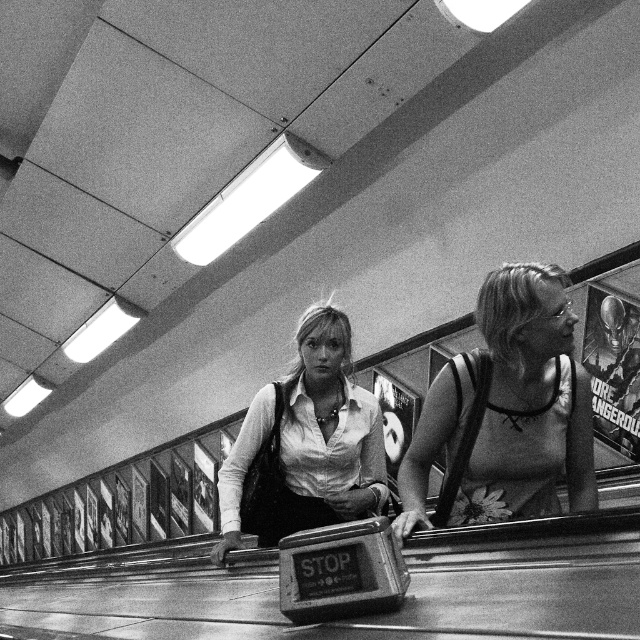
Question: Which point is closer to the camera taking this photo?

Choices:
 (A) pyautogui.click(x=472, y=509)
 (B) pyautogui.click(x=268, y=410)

Answer: (A)

Question: Does floral-patterned tank top at right come behind matte white shirt at center?

Choices:
 (A) no
 (B) yes

Answer: (A)

Question: Is floral-patterned tank top at right to the right of matte white shirt at center from the viewer's perspective?

Choices:
 (A) yes
 (B) no

Answer: (A)

Question: Among these points, which one is nearest to the camera?

Choices:
 (A) (316, 317)
 (B) (419, 499)

Answer: (B)

Question: Is floral-patterned tank top at right smaller than matte white shirt at center?

Choices:
 (A) no
 (B) yes

Answer: (B)